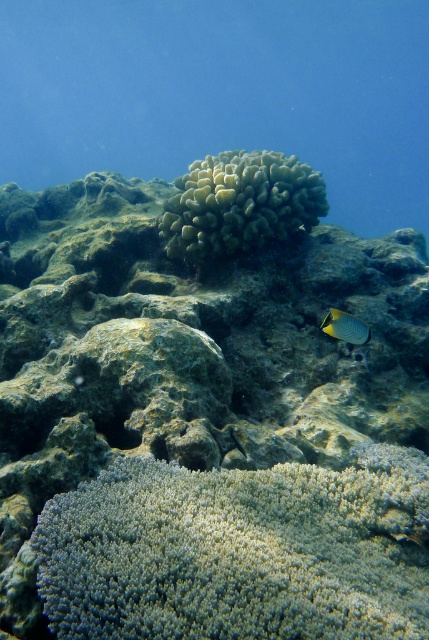
Is soft yellow coral at center positioned in front of shiny silver fish at center right?

No, soft yellow coral at center is behind shiny silver fish at center right.

Who is lower down, soft yellow coral at center or shiny silver fish at center right?

Positioned lower is shiny silver fish at center right.

Describe the element at coordinates (239, 204) in the screenshot. This screenshot has width=429, height=640. I see `soft yellow coral at center` at that location.

Identify the location of soft yellow coral at center. (239, 204).

Does green textured coral at center appear on the left side of shiny silver fish at center right?

Yes, green textured coral at center is to the left of shiny silver fish at center right.

Between green textured coral at center and shiny silver fish at center right, which one has less height?

Standing shorter between the two is shiny silver fish at center right.

Locate an element on the screen. Image resolution: width=429 pixels, height=640 pixels. green textured coral at center is located at coordinates (208, 416).

Find the location of a particular element. This screenshot has width=429, height=640. green textured coral at center is located at coordinates (208, 416).

Which is in front, point (100, 497) or point (227, 227)?

Point (100, 497) is in front.

Who is more forward, (32, 547) or (226, 228)?

Point (32, 547)

This screenshot has height=640, width=429. Find the location of `white coral at center`. white coral at center is located at coordinates [239, 552].